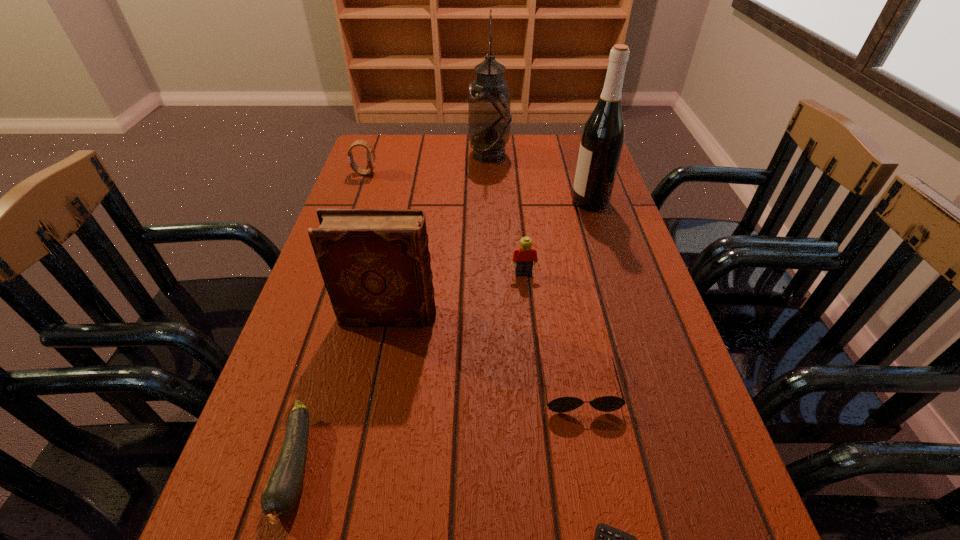
The height and width of the screenshot is (540, 960). Find the location of `vacant space located on the label of the sixth nearest object`. vacant space located on the label of the sixth nearest object is located at coordinates (429, 201).

At what (x,y) coordinates should I click in order to perform the action: click on vacant area situated on the label of the sixth nearest object. Please return your answer as a coordinate pair (x, y). Looking at the image, I should click on (437, 201).

At what (x,y) coordinates should I click in order to perform the action: click on vacant point located on the label of the sixth nearest object. Please return your answer as a coordinate pair (x, y). Looking at the image, I should click on (524, 201).

At what (x,y) coordinates should I click in order to perform the action: click on vacant space located 0.290m on the spine side of the hardback book. Please return your answer as a coordinate pair (x, y). This screenshot has width=960, height=540. Looking at the image, I should click on (577, 316).

Where is `free location located on the face of the seventh nearest object`? free location located on the face of the seventh nearest object is located at coordinates (446, 173).

This screenshot has height=540, width=960. Identify the location of vacant space located on the face of the fourth farthest object. (530, 332).

You are a GUI agent. You are given a task and a screenshot of the screen. Output one action in this format:
    pyautogui.click(x=<x>, y=<y>)
    Task: Click on the free location located on the front-facing side of the sunglasses
    
    Given the screenshot: What is the action you would take?
    pyautogui.click(x=607, y=537)

I want to click on oil lamp present at the far edge, so click(489, 117).

What are the coordinates of `watch that is at the far edge` in the screenshot? It's located at (370, 155).

Locate an element on the screen. This screenshot has height=540, width=960. hardback book positioned at the left edge is located at coordinates (375, 263).